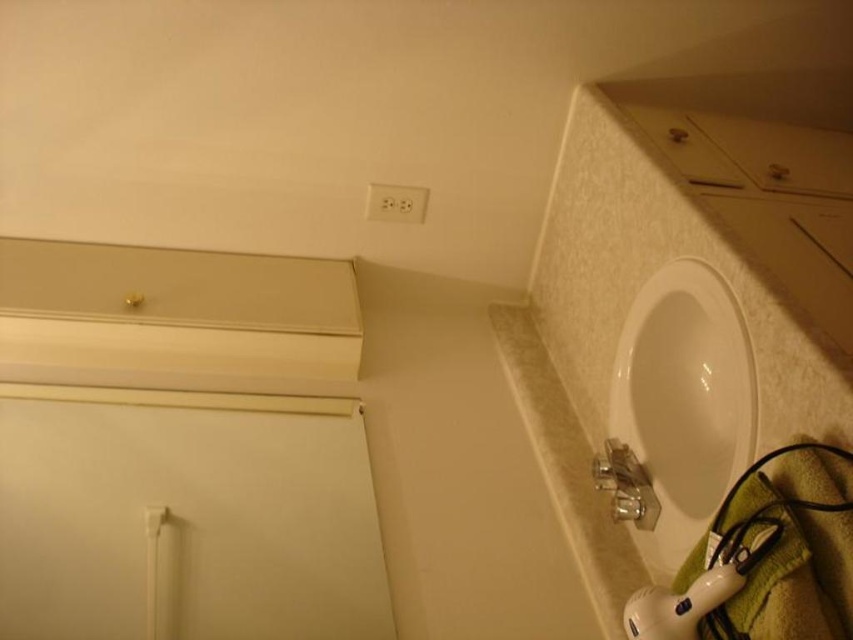
Question: Where is white glossy sink at lower right located in relation to white plastic outlet at upper center in the image?

Choices:
 (A) left
 (B) right

Answer: (B)

Question: Does white glossy sink at lower right appear on the left side of white plastic outlet at upper center?

Choices:
 (A) yes
 (B) no

Answer: (B)

Question: Which point is farther to the camera?

Choices:
 (A) white plastic outlet at upper center
 (B) white glossy sink at lower right

Answer: (A)

Question: Is white glossy sink at lower right smaller than white plastic outlet at upper center?

Choices:
 (A) yes
 (B) no

Answer: (B)